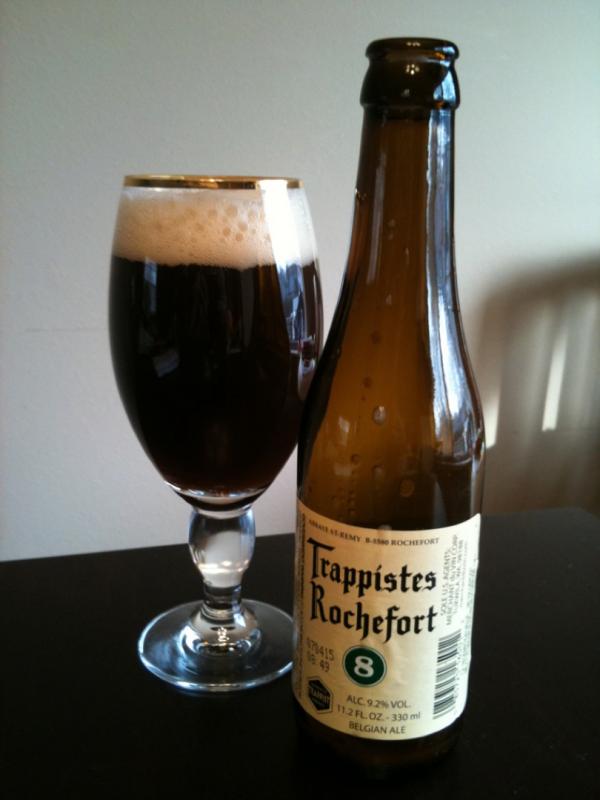
Where is `foam`? foam is located at coordinates (234, 230).